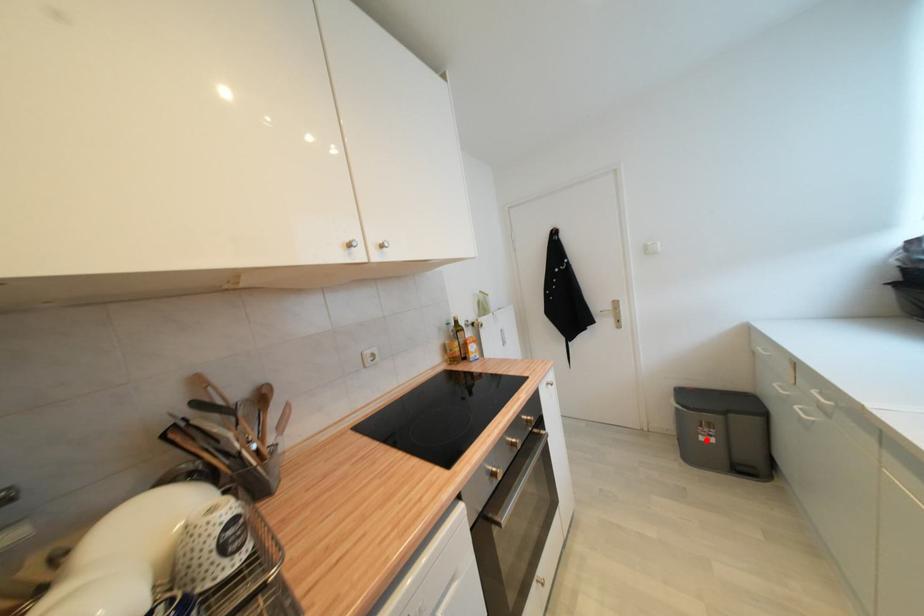
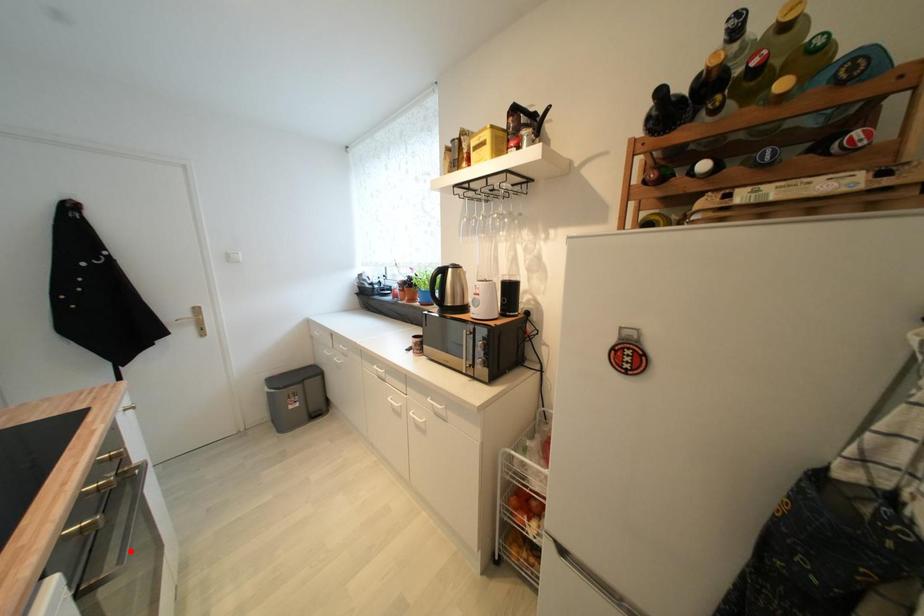
I am providing you with two images of the same scene from different viewpoints. A red point is marked on the first image and another point is marked on the second image. Does the point marked in image1 correspond to the same location as the one in image2?

No